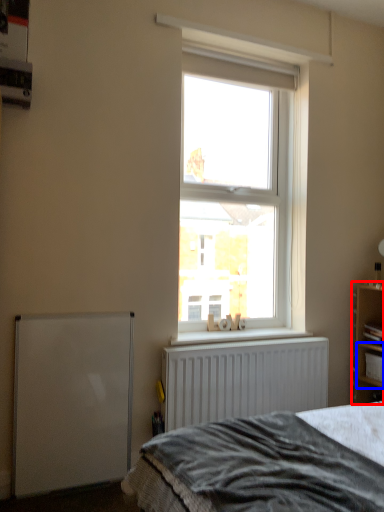
Question: Among these objects, which one is nearest to the camera, shelf (highlighted by a red box) or cabinet (highlighted by a blue box)?

Choices:
 (A) shelf
 (B) cabinet

Answer: (A)